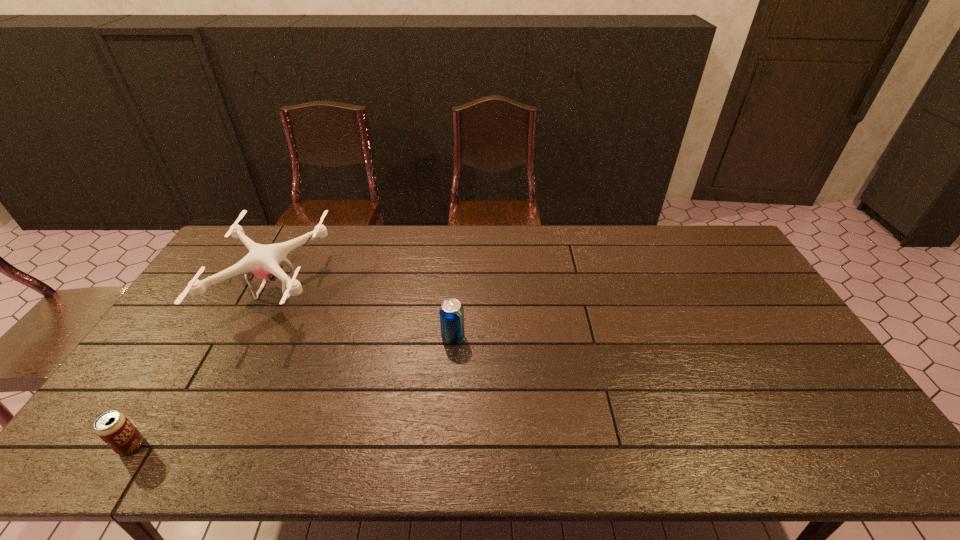
Identify the location of vacant space that's between the farther beer can and the drone. (365, 313).

At what (x,y) coordinates should I click in order to perform the action: click on vacant area between the taller beer can and the shortest object. Please return your answer as a coordinate pair (x, y). This screenshot has height=540, width=960. Looking at the image, I should click on (292, 392).

At what (x,y) coordinates should I click in order to perform the action: click on free area in between the taller beer can and the drone. Please return your answer as a coordinate pair (x, y). The height and width of the screenshot is (540, 960). Looking at the image, I should click on (365, 313).

Identify the location of vacant area between the tallest object and the shorter beer can. This screenshot has height=540, width=960. (204, 368).

Locate an element on the screen. The width and height of the screenshot is (960, 540). free space between the right beer can and the drone is located at coordinates (365, 313).

At what (x,y) coordinates should I click in order to perform the action: click on unoccupied position between the right beer can and the nearest object. Please return your answer as a coordinate pair (x, y). Looking at the image, I should click on [292, 392].

The height and width of the screenshot is (540, 960). Find the location of `free space between the nearest object and the right beer can`. free space between the nearest object and the right beer can is located at coordinates (292, 392).

This screenshot has width=960, height=540. I want to click on vacant space in between the drone and the rightmost object, so click(x=365, y=313).

Find the location of `free space between the tallest object and the taller beer can`. free space between the tallest object and the taller beer can is located at coordinates (365, 313).

Identify which object is the second closest to the shorter beer can. Please provide its 2D coordinates. Your answer should be formatted as a tuple, i.e. [(x, y)], where the tuple contains the x and y coordinates of a point satisfying the conditions above.

[(451, 312)]